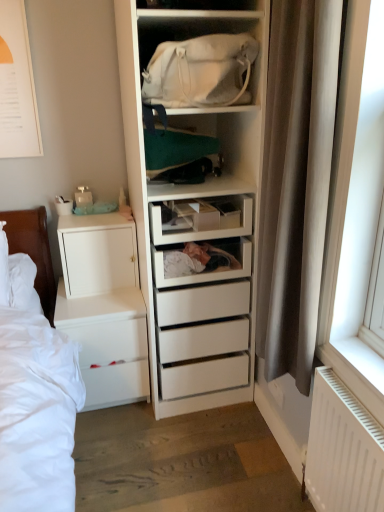
Question: From the image's perspective, does white fabric bag at upper center appear lower than white matte chest of drawers at lower left?

Choices:
 (A) no
 (B) yes

Answer: (A)

Question: From the image's perspective, is white fabric bag at upper center on top of white matte chest of drawers at lower left?

Choices:
 (A) yes
 (B) no

Answer: (A)

Question: Is white fabric bag at upper center behind white matte chest of drawers at lower left?

Choices:
 (A) yes
 (B) no

Answer: (B)

Question: Is white fabric bag at upper center far from white matte chest of drawers at lower left?

Choices:
 (A) yes
 (B) no

Answer: (B)

Question: Is white fabric bag at upper center bigger than white matte chest of drawers at lower left?

Choices:
 (A) no
 (B) yes

Answer: (A)

Question: Is white plastic drawer at center inside or outside of white matte chest of drawers at lower left?

Choices:
 (A) inside
 (B) outside

Answer: (B)

Question: Considering the positions of white plastic drawer at center and white matte chest of drawers at lower left in the image, is white plastic drawer at center taller or shorter than white matte chest of drawers at lower left?

Choices:
 (A) short
 (B) tall

Answer: (A)

Question: From a real-world perspective, relative to white matte chest of drawers at lower left, is white plastic drawer at center vertically above or below?

Choices:
 (A) above
 (B) below

Answer: (A)

Question: Based on their sizes in the image, would you say white plastic drawer at center is bigger or smaller than white matte chest of drawers at lower left?

Choices:
 (A) big
 (B) small

Answer: (B)

Question: Is white fabric bag at upper center bigger or smaller than brown fabric curtain at right?

Choices:
 (A) big
 (B) small

Answer: (B)

Question: In terms of height, does white fabric bag at upper center look taller or shorter compared to brown fabric curtain at right?

Choices:
 (A) tall
 (B) short

Answer: (B)

Question: Is white fabric bag at upper center inside or outside of brown fabric curtain at right?

Choices:
 (A) outside
 (B) inside

Answer: (A)

Question: Is point (200, 101) closer or farther from the camera than point (276, 199)?

Choices:
 (A) closer
 (B) farther

Answer: (A)

Question: Considering the positions of white matte cabinet at left and white plastic radiator at lower right in the image, is white matte cabinet at left bigger or smaller than white plastic radiator at lower right?

Choices:
 (A) small
 (B) big

Answer: (B)

Question: Is white matte cabinet at left in front of or behind white plastic radiator at lower right in the image?

Choices:
 (A) behind
 (B) front

Answer: (A)